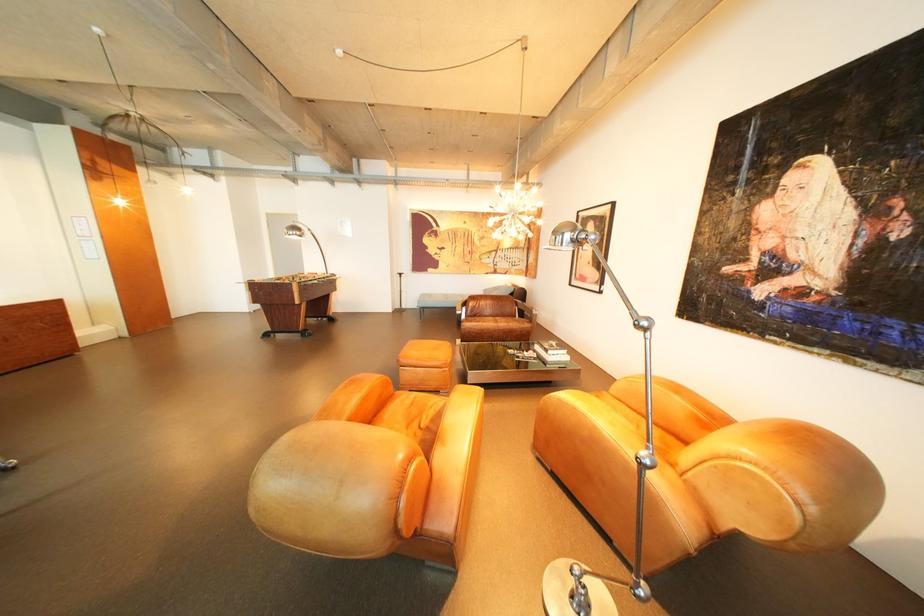
Describe the element at coordinates (570, 237) in the screenshot. The height and width of the screenshot is (616, 924). I see `the chrome lamp head` at that location.